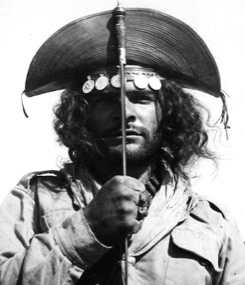
This screenshot has width=245, height=285. Identify the location of wooden handle. (119, 25).